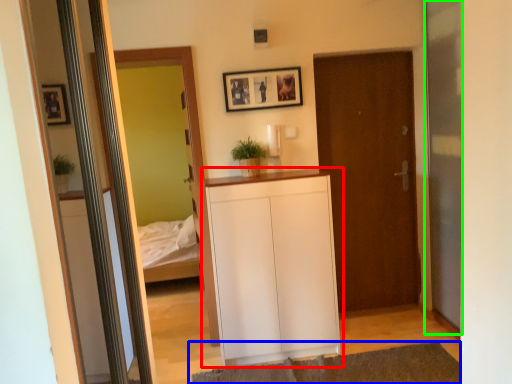
Question: Considering the real-world distances, which object is farthest from cabinetry (highlighted by a red box)? plain (highlighted by a blue box) or screen door (highlighted by a green box)?

Choices:
 (A) plain
 (B) screen door

Answer: (B)